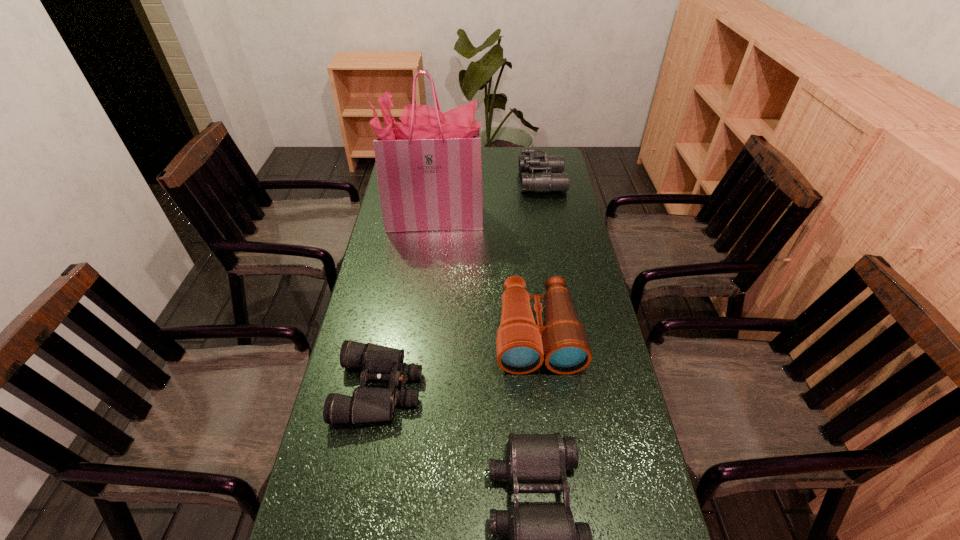
Choose which object is the fourth nearest neighbor to the fourth tallest object. Please provide its 2D coordinates. Your answer should be formatted as a tuple, i.e. [(x, y)], where the tuple contains the x and y coordinates of a point satisfying the conditions above.

[(539, 172)]

Locate an element on the screen. binoculars that is the third nearest to the tallest object is located at coordinates (379, 363).

Locate which binoculars ranks third in proximity to the leftmost binoculars. Please provide its 2D coordinates. Your answer should be formatted as a tuple, i.e. [(x, y)], where the tuple contains the x and y coordinates of a point satisfying the conditions above.

[(539, 172)]